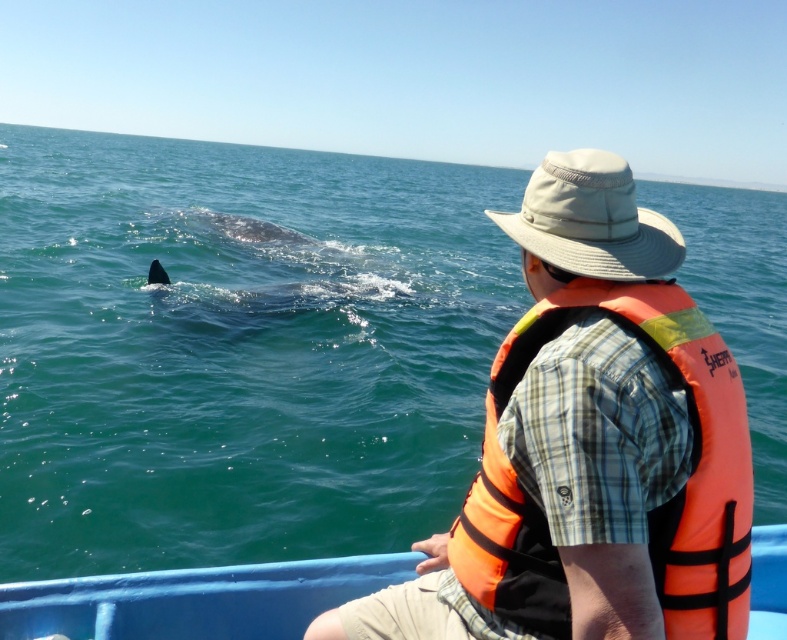
You are a safety inspector checking the boat setup. The green water at whale left and orange fabric life vest at right are both visible from your vantage point. Which object is positioned higher in the scene?

The green water at whale left is located above the orange fabric life vest at right, so it is positioned higher in the scene.

You are planning to take a boat trip and need to know the size of the boat relative to the surrounding water. Based on the scene, which object is bigger in size between the green water at whale left and the blue plastic boat at center?

The green water at whale left is larger in size compared to the blue plastic boat at center according to the description.

You are a safety inspector checking the boat for proper equipment placement. The green water at whale left and orange fabric life vest at right are both visible from your vantage point. Which object is positioned to the left of the other?

The green water at whale left is to the left of orange fabric life vest at right, so the green water at whale left is positioned to the left of the orange fabric life vest at right.